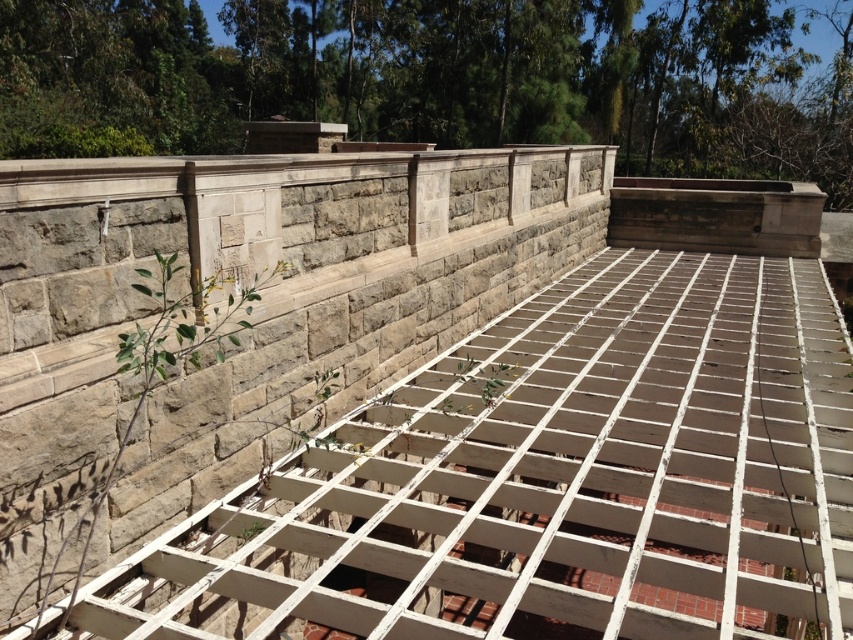
You are standing in front of the gray stone wall at upper center and the green leafy plant at left. Which object is positioned higher in the image?

The gray stone wall at upper center is positioned higher than the green leafy plant at left.

You are a gardener planning to place a decorative pot between the gray stone wall at upper center and the green leafy plant at left. Given their widths, which object requires more space horizontally?

The gray stone wall at upper center requires more horizontal space because its width is larger than the green leafy plant at left.